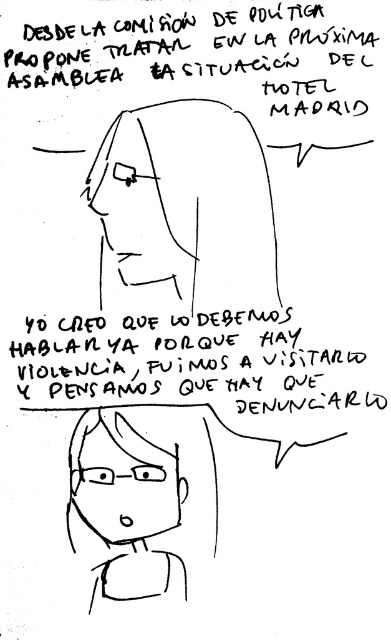
In the scene shown: You are an artist who wants to add a new element between the matte black hair at upper center and the black paper text at upper center in the drawing. Given that the space between them is 5.65 inches, can you fit a small speech bubble that requires 3 inches of space?

The distance between the matte black hair at upper center and the black paper text at upper center is 5.65 inches. Since the required space for the speech bubble is 3 inches, which is less than the available distance, the speech bubble can be placed between them.

You are an art student analyzing a digital drawing. You notice the matte black hair at upper center and the black handwritten text at center. Which object is closer to the viewer?

The matte black hair at upper center is closer to the viewer because it is in front of the black handwritten text at center.